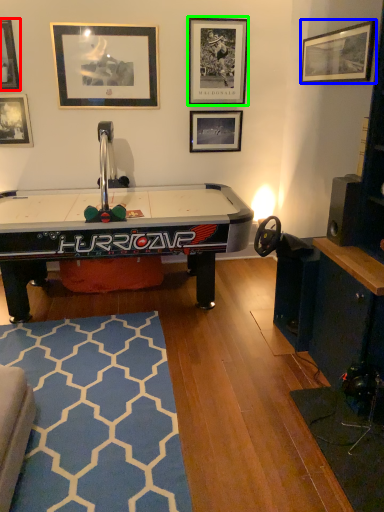
Question: Which object is positioned farthest from picture frame (highlighted by a red box)? Select from picture frame (highlighted by a blue box) and picture frame (highlighted by a green box).

Choices:
 (A) picture frame
 (B) picture frame

Answer: (A)